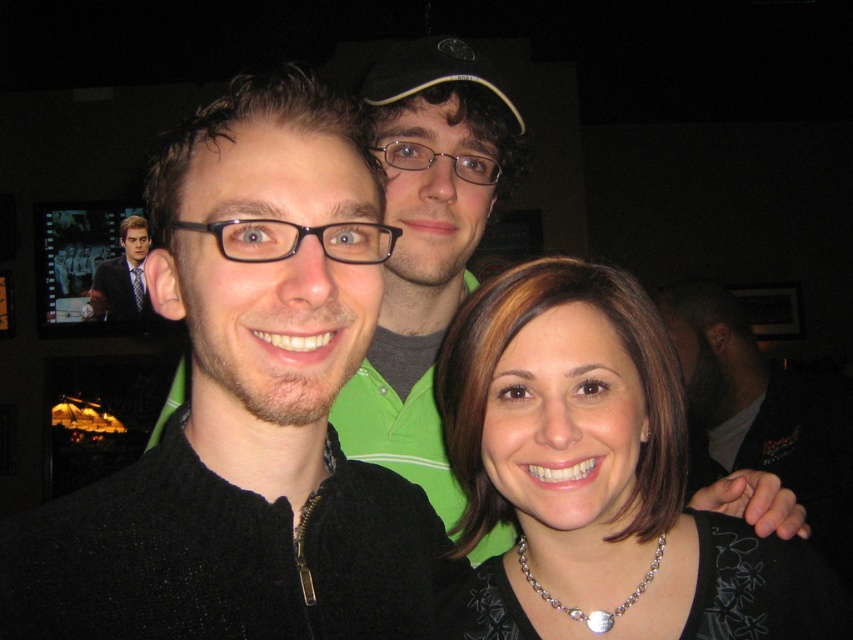
Question: Does matte black necklace at center have a lesser width compared to matte black suit at upper left?

Choices:
 (A) no
 (B) yes

Answer: (B)

Question: Is matte black necklace at center further to camera compared to matte black suit at upper left?

Choices:
 (A) no
 (B) yes

Answer: (A)

Question: Does matte black necklace at center have a greater width compared to matte black suit at upper left?

Choices:
 (A) yes
 (B) no

Answer: (B)